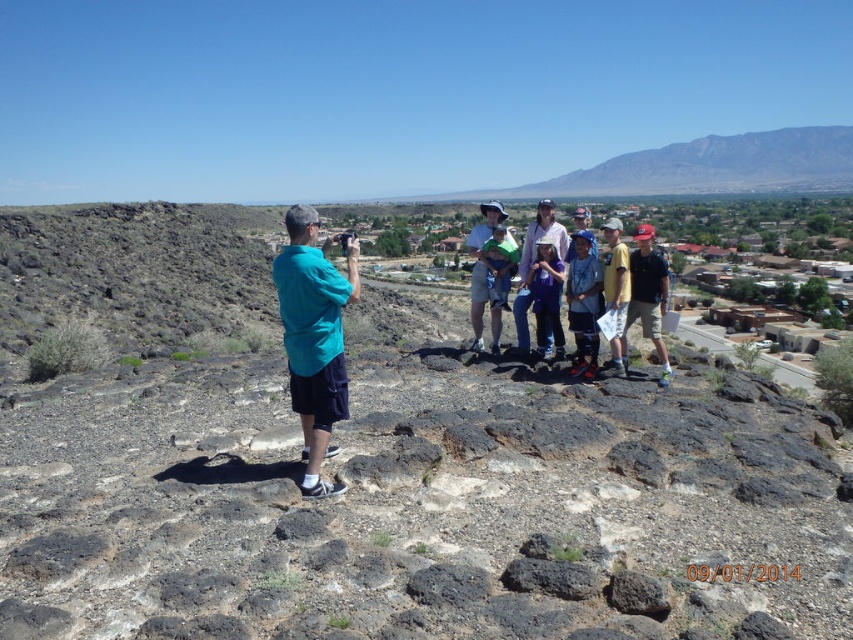
Question: Is teal fabric shirt at left wider than green fabric shirt at center?

Choices:
 (A) no
 (B) yes

Answer: (B)

Question: Based on their relative distances, which object is farther from the purple cotton shirt at center?

Choices:
 (A) teal fabric shirt at left
 (B) green fabric shirt at center

Answer: (B)

Question: Which of the following is the farthest from the observer?

Choices:
 (A) green fabric shirt at center
 (B) teal fabric shirt at left
 (C) purple cotton shirt at center

Answer: (A)

Question: Based on their relative distances, which object is farther from the matte blue shirt at right?

Choices:
 (A) teal fabric shirt at left
 (B) purple cotton shirt at center
 (C) green fabric shirt at center

Answer: (C)

Question: Can you confirm if teal fabric shirt at left is positioned below matte blue shirt at right?

Choices:
 (A) yes
 (B) no

Answer: (B)

Question: Considering the relative positions of teal fabric shirt at left and green fabric shirt at center in the image provided, where is teal fabric shirt at left located with respect to green fabric shirt at center?

Choices:
 (A) left
 (B) right

Answer: (A)